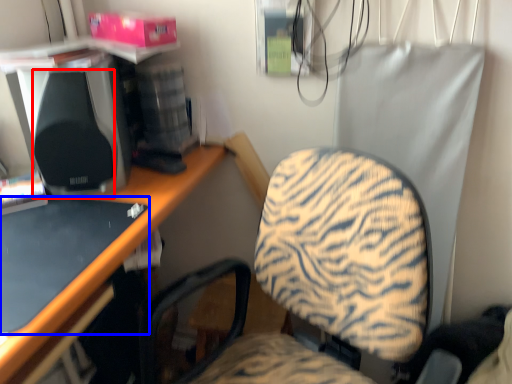
Question: Which of the following is the closest to the observer, speaker (highlighted by a red box) or desktop (highlighted by a blue box)?

Choices:
 (A) speaker
 (B) desktop

Answer: (B)